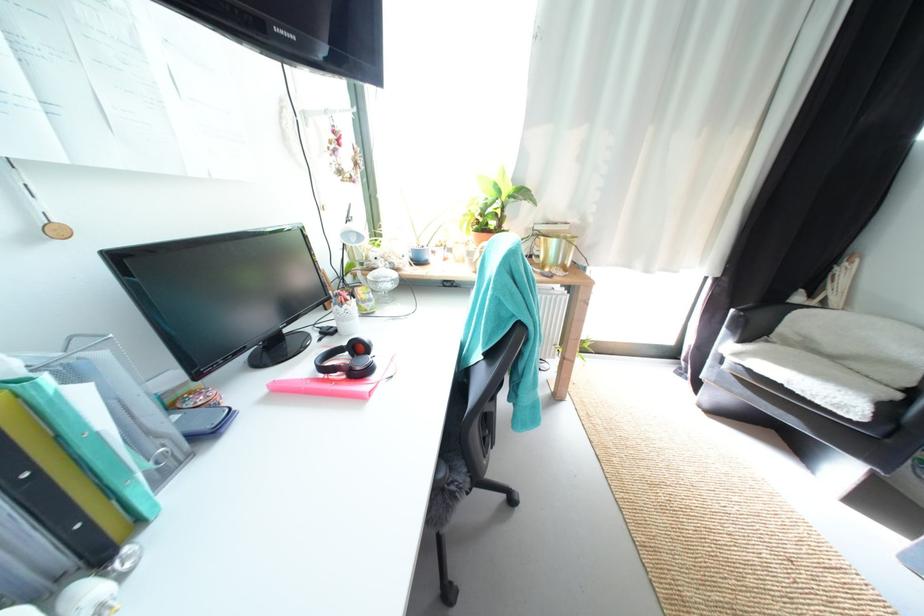
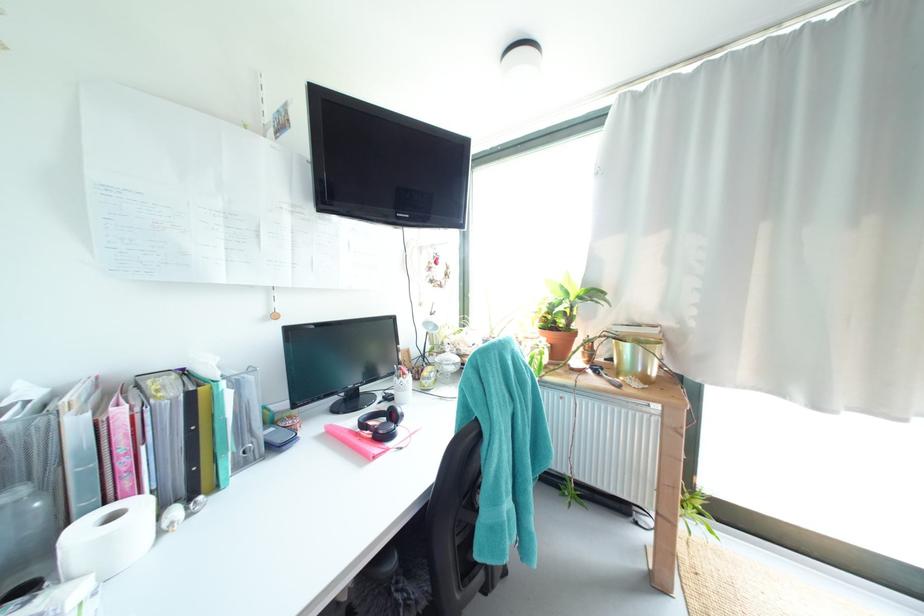
In the second image, find the point that corresponds to the point at 348,306 in the first image.

(407, 379)